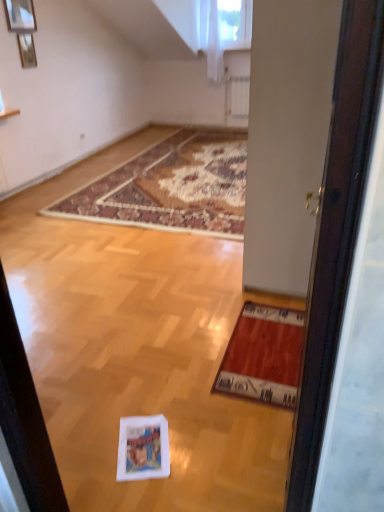
This screenshot has width=384, height=512. In order to click on free location above red fabric yoga mat at lower right (from a real-world perspective) in this screenshot , I will do `click(269, 338)`.